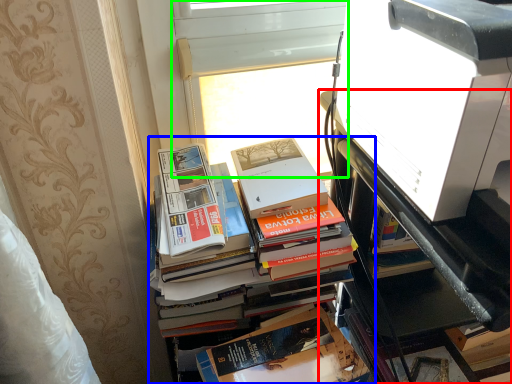
Question: Estimate the real-world distances between objects in this image. Which object is farther from bookcase (highlighted by a red box), book (highlighted by a blue box) or window screen (highlighted by a green box)?

Choices:
 (A) book
 (B) window screen

Answer: (B)